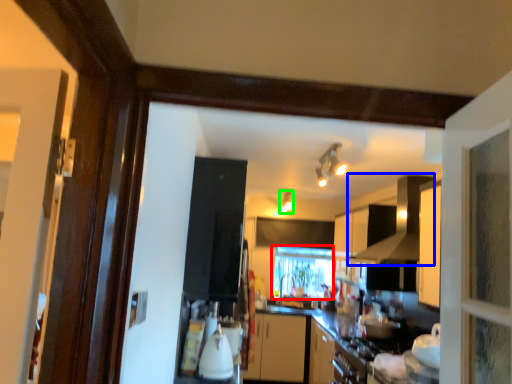
Question: Estimate the real-world distances between objects in this image. Which object is closer to window (highlighted by a red box), exhaust hood (highlighted by a blue box) or light fixture (highlighted by a green box)?

Choices:
 (A) exhaust hood
 (B) light fixture

Answer: (B)